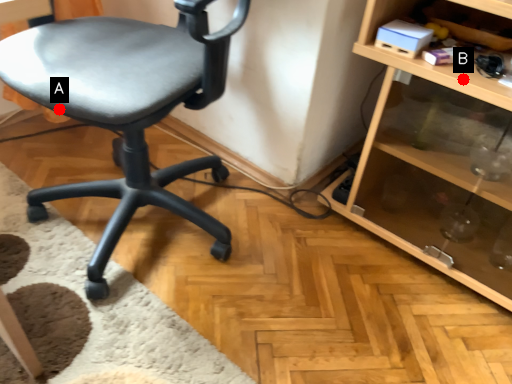
Question: Two points are circled on the image, labeled by A and B beside each circle. Which point is farther from the camera taking this photo?

Choices:
 (A) A is further
 (B) B is further

Answer: (B)